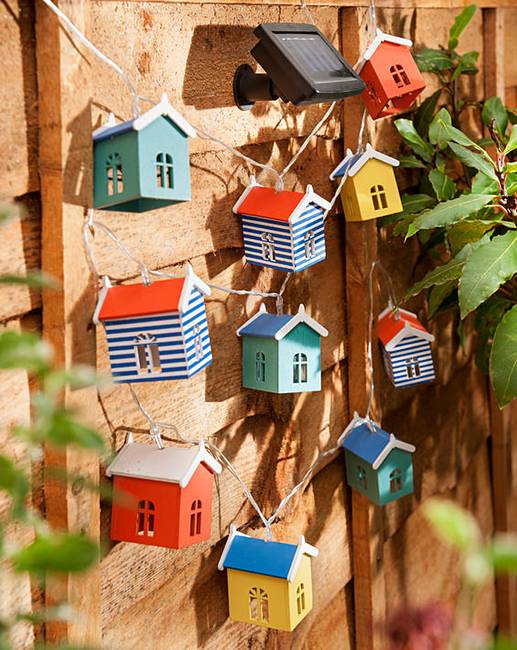
This screenshot has width=517, height=650. Find the location of `wall`. wall is located at coordinates (167, 584).